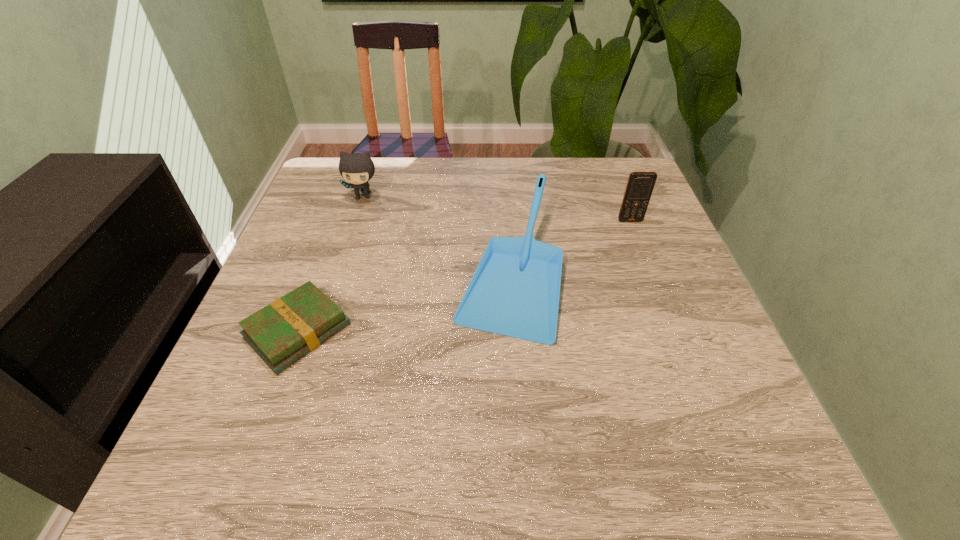
Locate which object is the second closest to the shortest object. Please provide its 2D coordinates. Your answer should be formatted as a tuple, i.e. [(x, y)], where the tuple contains the x and y coordinates of a point satisfying the conditions above.

[(356, 168)]

Image resolution: width=960 pixels, height=540 pixels. What are the coordinates of `object that ranks as the closest to the book` in the screenshot? It's located at (515, 290).

Where is `vacant position in the image that satisfies the following two spatial constraints: 1. on the front-facing side of the dustpan; 2. on the right side of the kitten`? This screenshot has width=960, height=540. vacant position in the image that satisfies the following two spatial constraints: 1. on the front-facing side of the dustpan; 2. on the right side of the kitten is located at coordinates (339, 270).

I want to click on vacant region that satisfies the following two spatial constraints: 1. on the front-facing side of the farthest object; 2. on the left side of the second object from right to left, so click(339, 270).

Where is `free region that satisfies the following two spatial constraints: 1. on the front-facing side of the kitten; 2. on the left side of the dustpan`? Image resolution: width=960 pixels, height=540 pixels. free region that satisfies the following two spatial constraints: 1. on the front-facing side of the kitten; 2. on the left side of the dustpan is located at coordinates (339, 270).